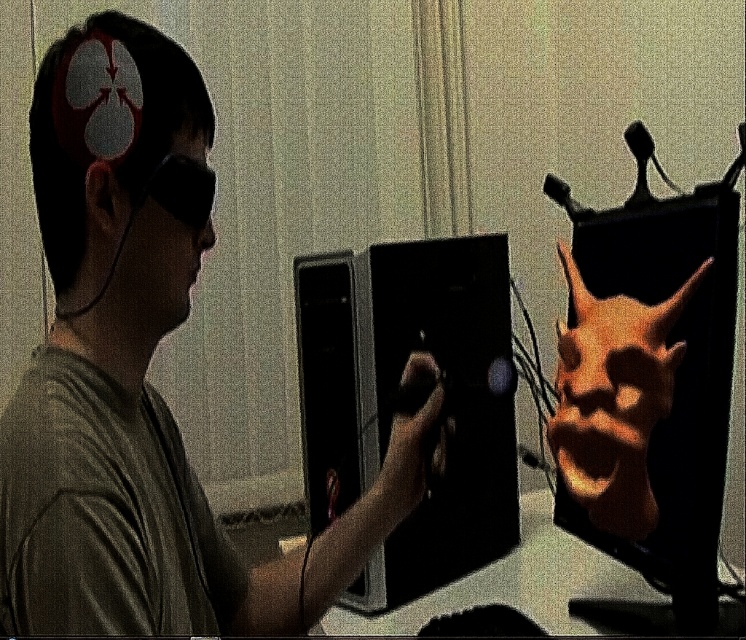
Which is more to the right, orange matte mask at right or black glossy monitor at center?

Positioned to the right is orange matte mask at right.

Is the position of orange matte mask at right less distant than that of black glossy monitor at center?

Yes.

You are a GUI agent. You are given a task and a screenshot of the screen. Output one action in this format:
    pyautogui.click(x=<x>, y=<y>)
    Task: Click on the orange matte mask at right
    This screenshot has height=640, width=746.
    Given the screenshot: What is the action you would take?
    coord(648,385)

Can you confirm if orange matte mask at right is taller than matte black headphones at left?

Correct, orange matte mask at right is much taller as matte black headphones at left.

What do you see at coordinates (648, 385) in the screenshot? This screenshot has width=746, height=640. I see `orange matte mask at right` at bounding box center [648, 385].

This screenshot has width=746, height=640. What are the coordinates of `orange matte mask at right` in the screenshot? It's located at (648, 385).

Can you confirm if matte black laptop at left is taller than orange matte mask at right?

Yes, matte black laptop at left is taller than orange matte mask at right.

Can you confirm if matte black laptop at left is smaller than orange matte mask at right?

No.

Does point (128, 188) lie in front of point (618, 228)?

Yes.

At what (x,y) coordinates should I click in order to perform the action: click on matte black laptop at left. Please return your answer as a coordinate pair (x, y). Image resolution: width=746 pixels, height=640 pixels. Looking at the image, I should click on (142, 376).